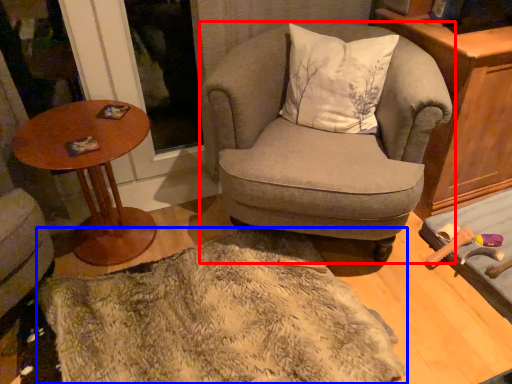
Question: Among these objects, which one is farthest to the camera, chair (highlighted by a red box) or blanket (highlighted by a blue box)?

Choices:
 (A) chair
 (B) blanket

Answer: (A)